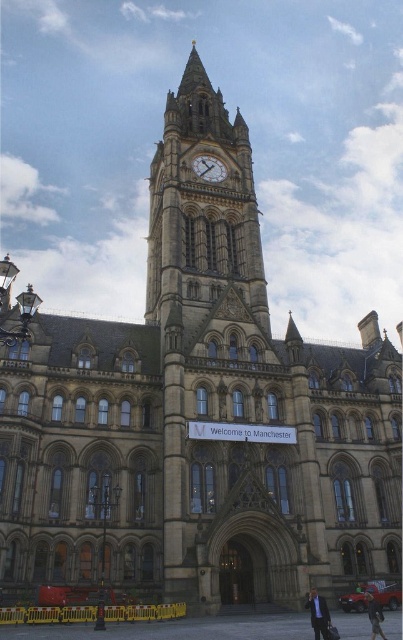
You are a tourist standing in front of the Manchester Town Hall. You notice the golden stone clock tower at center and the gold textured clock at center. Which object is closer to you?

The golden stone clock tower at center is closer to you because it is in front of the gold textured clock at center.

From the picture: You are a tourist standing at the entrance of the Manchester Town Hall. You notice the golden stone clock tower at center and the gold textured clock at center. Which one is located higher up in the image?

The golden stone clock tower at center is positioned over the gold textured clock at center, so it is located higher up in the image.

You are standing in front of the Manchester Town Hall and want to take a photo of both the clock tower and the welcome banner. You notice two points marked on your map at coordinates point [170,109] and point [207,163]. Which point should you stand closer to ensure both the clock tower and the welcome banner are in frame?

You should stand closer to point [170,109] because it is closer to the viewer than point [207,163], allowing both the clock tower and the welcome banner to be in frame.